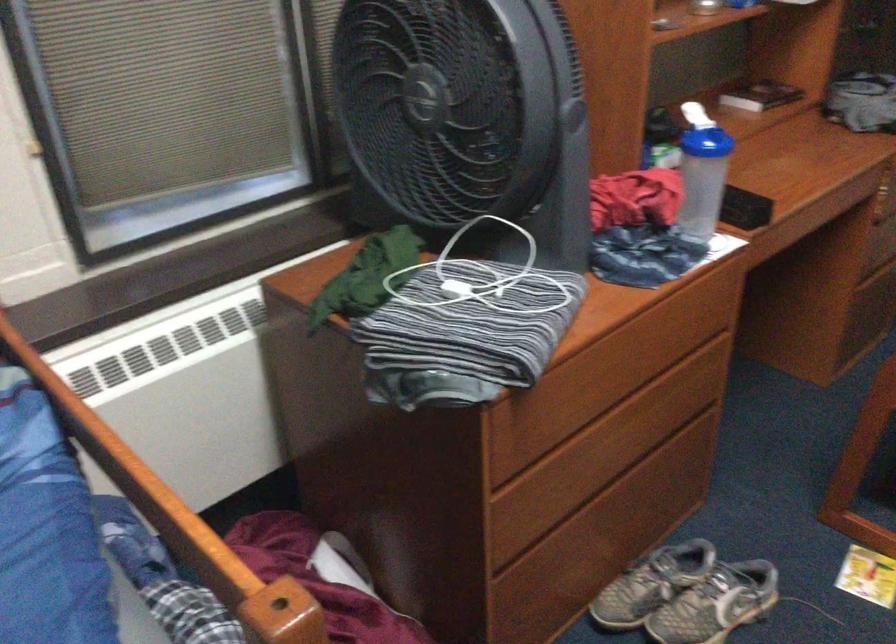
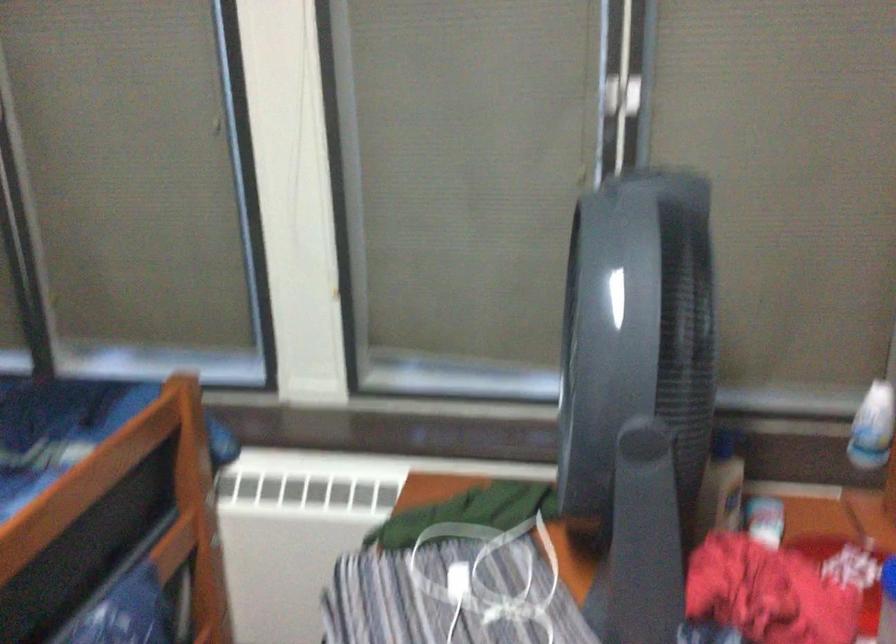
Locate, in the second image, the point that corresponds to (x=572, y=180) in the first image.

(645, 521)